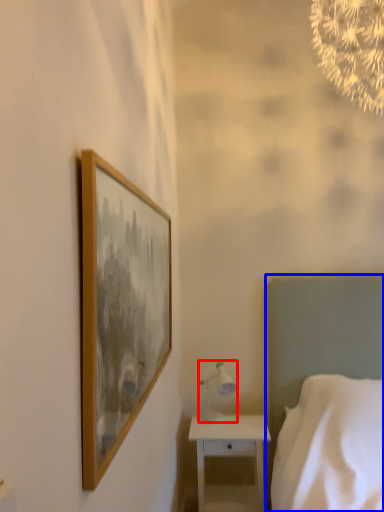
Question: Which object is further to the camera taking this photo, table lamp (highlighted by a red box) or bed (highlighted by a blue box)?

Choices:
 (A) table lamp
 (B) bed

Answer: (A)